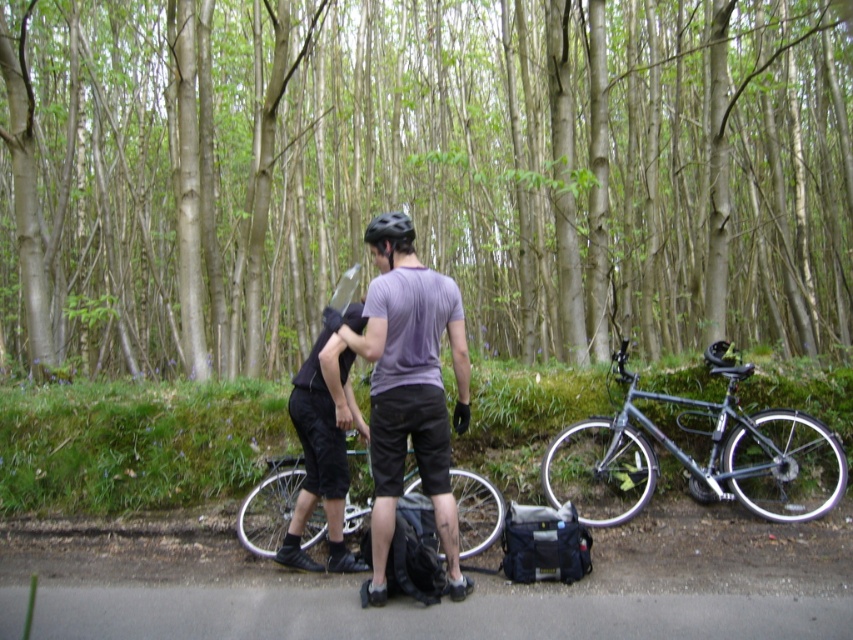
In the scene shown: You are a hiker who wants to take a photo of the black matte helmet at center and the metallic silver bicycle at right. To get both in the frame, should you move forward or backward?

The black matte helmet at center is behind the metallic silver bicycle at right, so you should move forward to ensure both are visible in the frame.

You are standing at the center of the image and want to move towards the metallic silver bicycle at right. Which direction should you move in?

Since the metallic silver bicycle at right is located at point (x=692, y=454), you should move towards the right side of the image to reach it.

You are planning to take a photo of the green leafy tree at center and the metallic silver bicycle at right from a position where both are in the frame. Given that the tree is 7.27 meters away from the bicycle, what is the minimum distance you need to stand from the tree to ensure both are fully visible?

To capture both the green leafy tree at center and the metallic silver bicycle at right in the same frame, you need to position yourself at least 7.27 meters away from the tree. This ensures that the distance between the tree and the bicycle is accommodated within the camera frame.